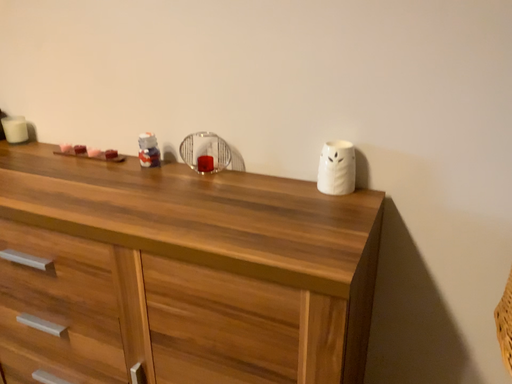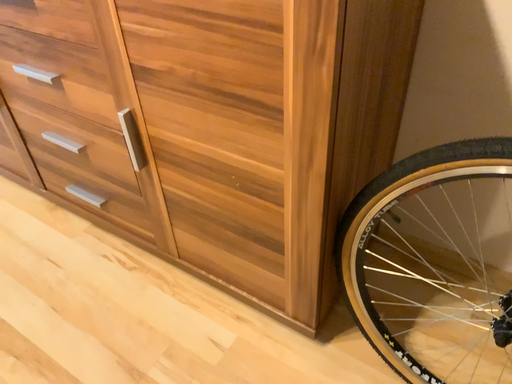
Question: Which way did the camera rotate in the video?

Choices:
 (A) rotated right
 (B) rotated left

Answer: (B)